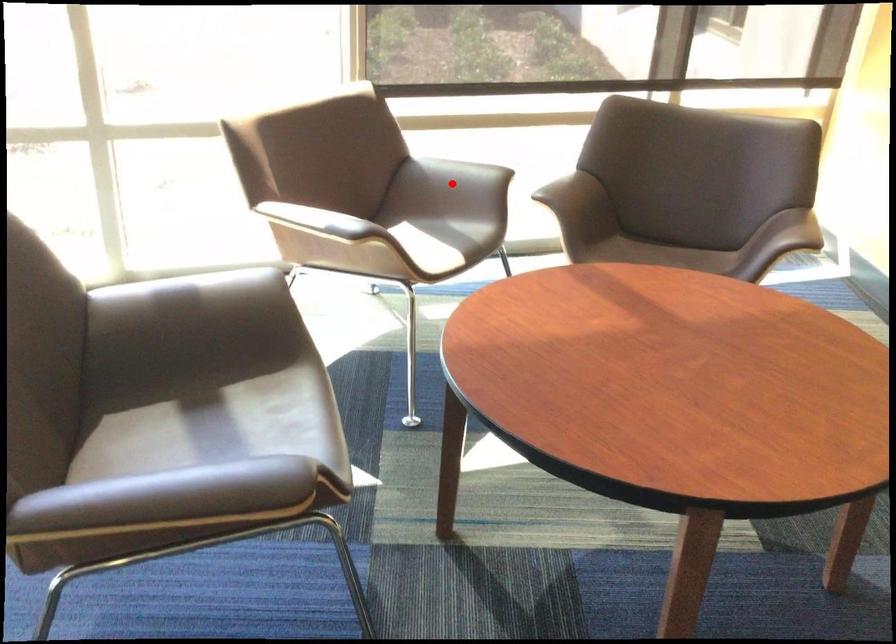
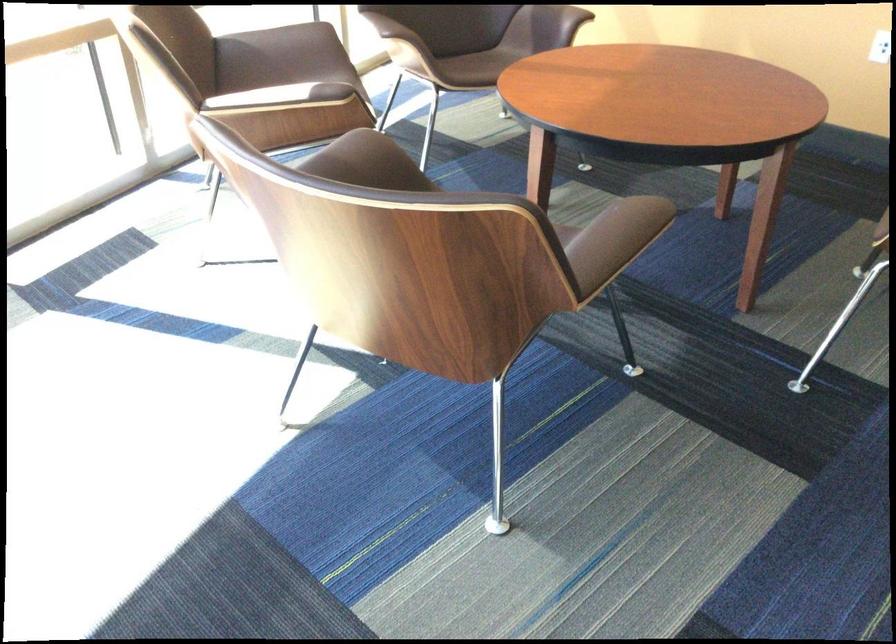
Find the pixel in the second image that matches the highlighted location in the first image.

(281, 55)